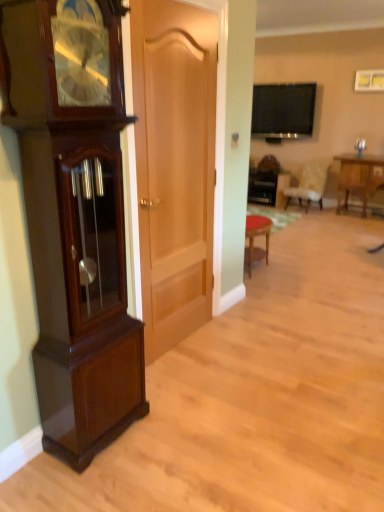
Question: Is wooden table at center, which is counted as the first table, starting from the back, outside of light beige fabric chair at center?

Choices:
 (A) no
 (B) yes

Answer: (B)

Question: Can you confirm if wooden table at center, which appears as the second table when viewed from the front, is smaller than light beige fabric chair at center?

Choices:
 (A) no
 (B) yes

Answer: (A)

Question: Is light beige fabric chair at center inside wooden table at center, which appears as the second table when viewed from the front?

Choices:
 (A) yes
 (B) no

Answer: (B)

Question: From the image's perspective, would you say wooden table at center, which appears as the second table when viewed from the front, is positioned over light beige fabric chair at center?

Choices:
 (A) yes
 (B) no

Answer: (A)

Question: From a real-world perspective, does wooden table at center, which appears as the second table when viewed from the front, sit lower than light beige fabric chair at center?

Choices:
 (A) yes
 (B) no

Answer: (A)

Question: Looking at their shapes, would you say wooden table at right, the first table viewed from the front, is wider or thinner than light brown wood door at center?

Choices:
 (A) thin
 (B) wide

Answer: (B)

Question: In terms of size, does wooden table at right, which is the second table in left-to-right order, appear bigger or smaller than light brown wood door at center?

Choices:
 (A) small
 (B) big

Answer: (B)

Question: Is point (352, 186) positioned closer to the camera than point (155, 256)?

Choices:
 (A) farther
 (B) closer

Answer: (A)

Question: Is wooden table at right, the first table viewed from the right, in front of or behind light brown wood door at center in the image?

Choices:
 (A) behind
 (B) front

Answer: (A)

Question: From a real-world perspective, is wooden table at center, which is counted as the first table, starting from the back, above or below light beige fabric chair at center?

Choices:
 (A) below
 (B) above

Answer: (A)

Question: Considering the positions of wooden table at center, which is counted as the first table, starting from the back, and light beige fabric chair at center in the image, is wooden table at center, which is counted as the first table, starting from the back, wider or thinner than light beige fabric chair at center?

Choices:
 (A) thin
 (B) wide

Answer: (A)

Question: From the image's perspective, relative to light beige fabric chair at center, is wooden table at center, which appears as the second table when viewed from the front, above or below?

Choices:
 (A) above
 (B) below

Answer: (A)

Question: Does point (253, 172) appear closer or farther from the camera than point (288, 200)?

Choices:
 (A) farther
 (B) closer

Answer: (A)

Question: In terms of size, does wooden table at center, the 2th table positioned from the right, appear bigger or smaller than flat-screen tv at upper center?

Choices:
 (A) big
 (B) small

Answer: (A)

Question: From the image's perspective, is wooden table at center, positioned as the first table in left-to-right order, positioned above or below flat-screen tv at upper center?

Choices:
 (A) above
 (B) below

Answer: (B)